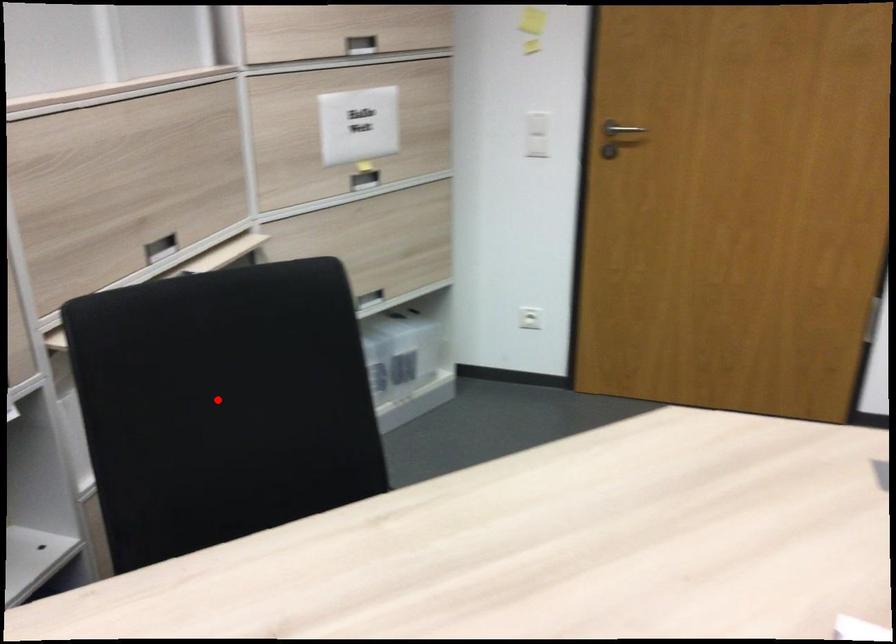
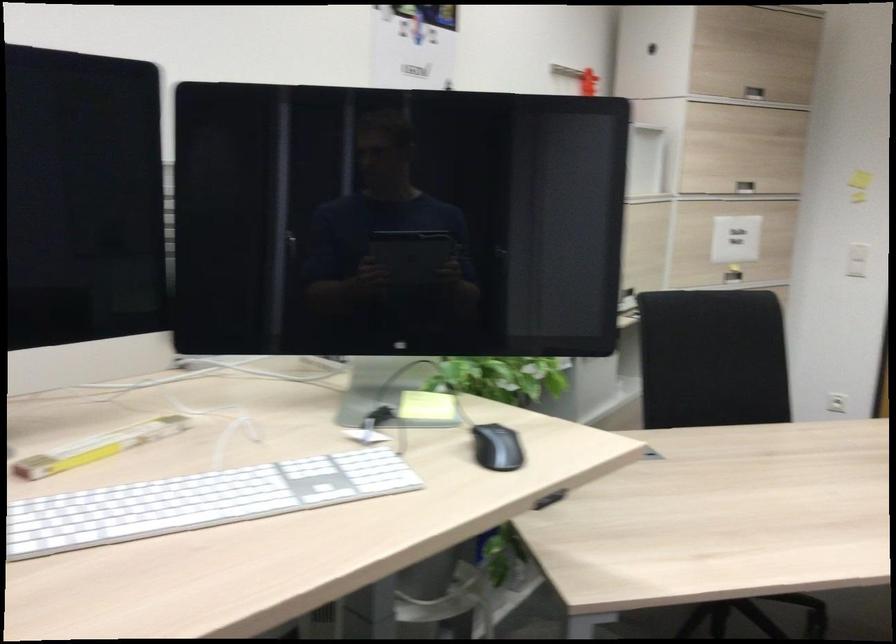
Where in the second image is the point corresponding to the highlighted location from the first image?

(712, 359)